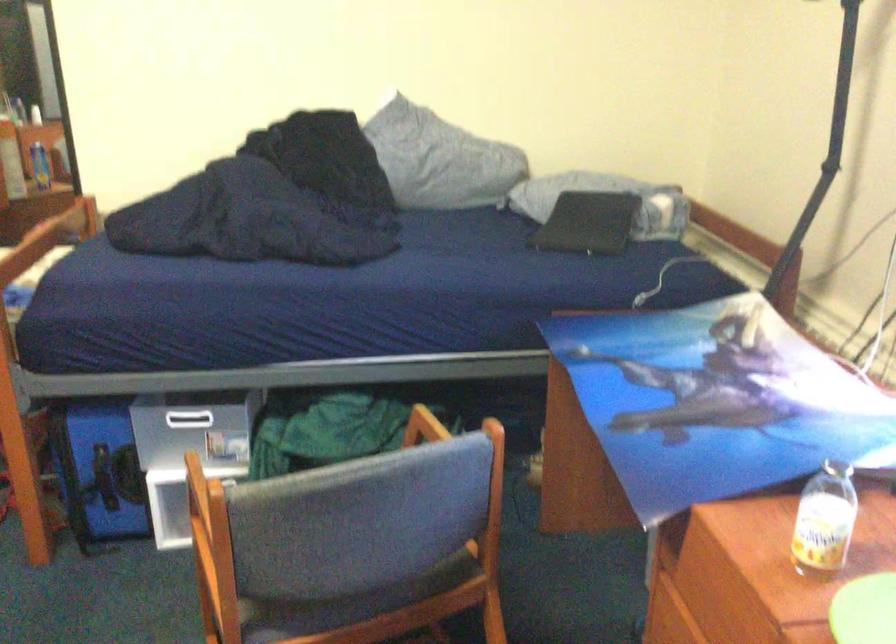
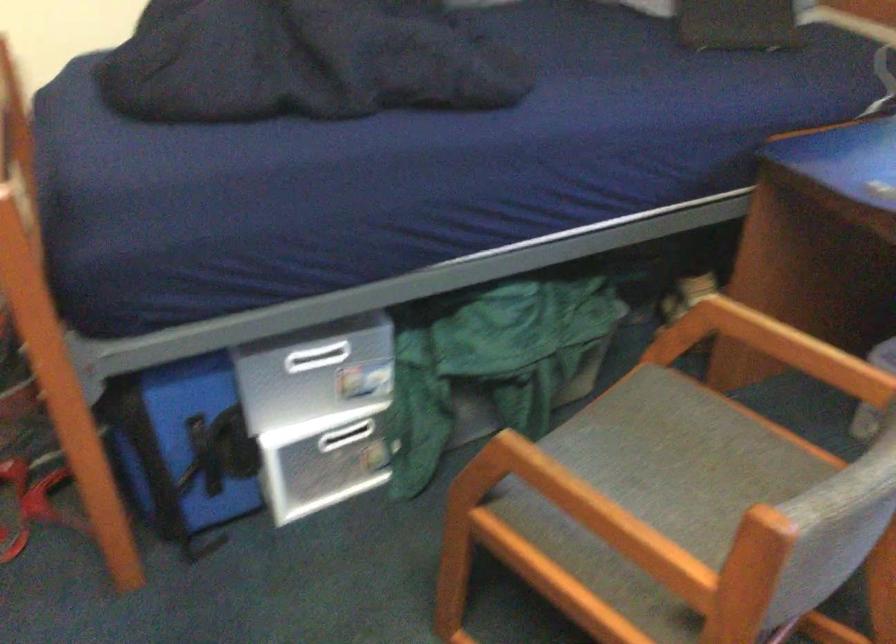
Where in the second image is the point corresponding to pixel 213 506 from the first image?

(597, 514)